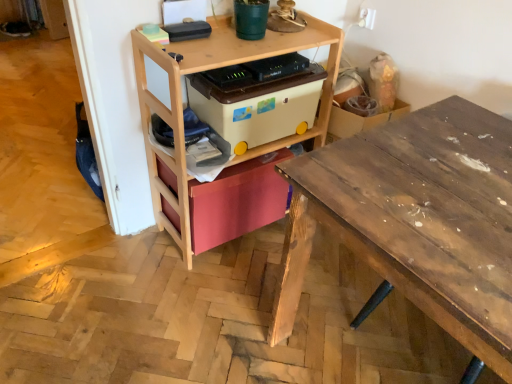
Where is `free space in front of wooden shelf at center`? free space in front of wooden shelf at center is located at coordinates (209, 298).